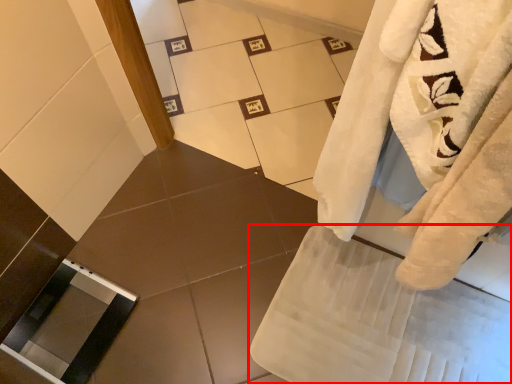
Question: From the image, what is the correct spatial relationship of bath towel (annotated by the red box) in relation to screen door?

Choices:
 (A) right
 (B) left

Answer: (A)